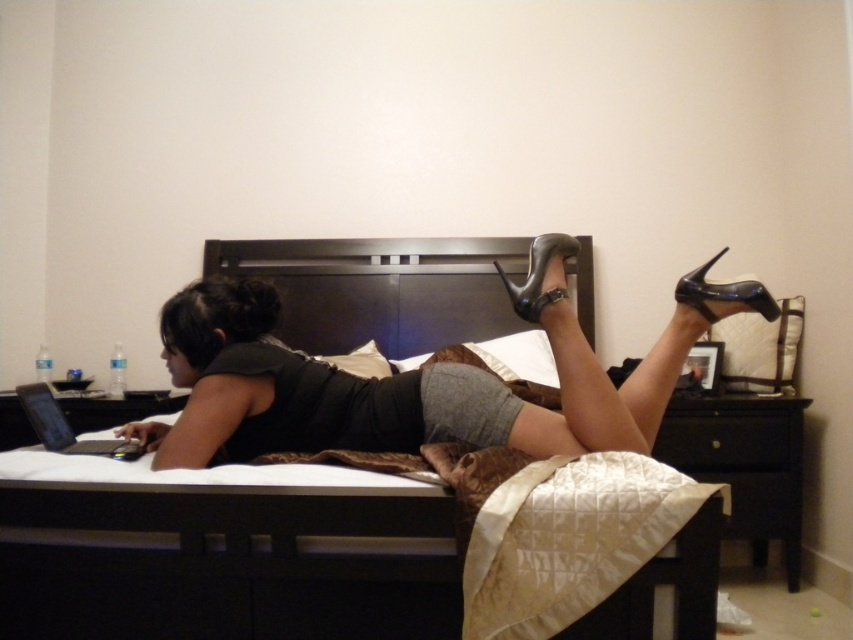
You are an interior designer planning to place a new sofa in the room. The sofa is the same size as the dark wood bed at center. Will the sofa fit in the space where the dark wood headboard at center is currently located?

The dark wood bed at center has a smaller size compared to dark wood headboard at center. Therefore, the sofa, which is the same size as the dark wood bed at center, will not fit in the space where the dark wood headboard at center is located because it is smaller than the headboard.